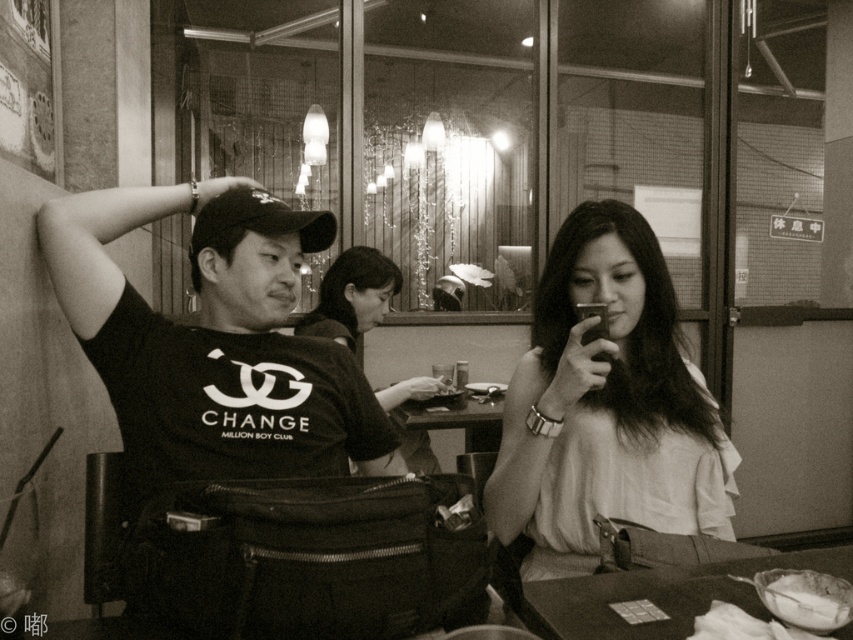
Question: Among these objects, which one is nearest to the camera?

Choices:
 (A) white creamy food at lower right
 (B) white fabric shirt at center
 (C) black matte cap at upper left
 (D) smooth black table at lower right

Answer: (D)

Question: Is smooth black table at lower right bigger than smooth fabric blouse at center?

Choices:
 (A) no
 (B) yes

Answer: (A)

Question: Which of the following is the closest to the observer?

Choices:
 (A) black matte cap at upper left
 (B) white creamy food at lower right
 (C) smooth black table at lower right

Answer: (C)

Question: From the image, what is the correct spatial relationship of black matte cap at upper left in relation to white creamy food at lower right?

Choices:
 (A) right
 (B) left

Answer: (B)

Question: Considering the real-world distances, which object is closest to the smooth black table at lower right?

Choices:
 (A) black matte cap at upper left
 (B) white fabric shirt at center

Answer: (B)

Question: Does black matte cap at upper left lie in front of smooth black table at lower right?

Choices:
 (A) no
 (B) yes

Answer: (A)